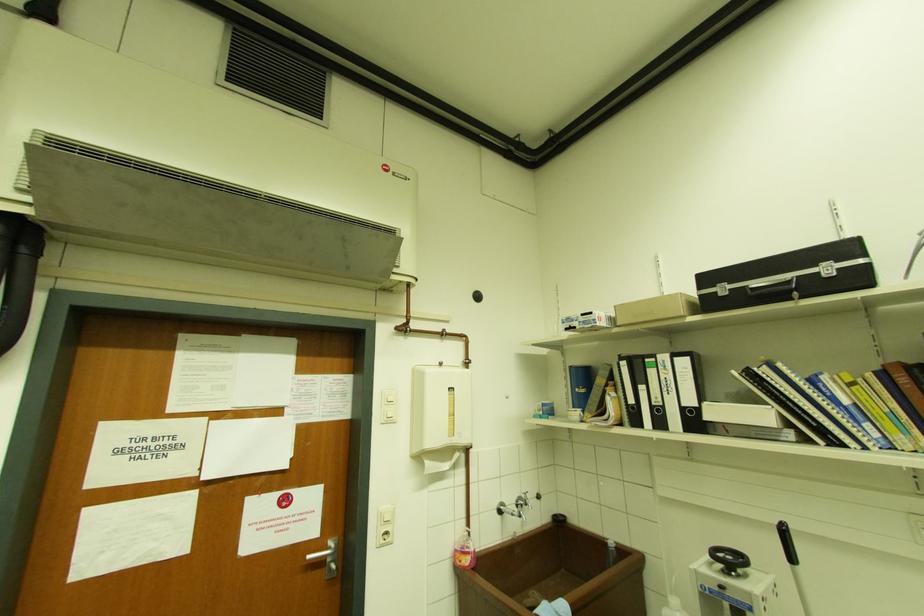
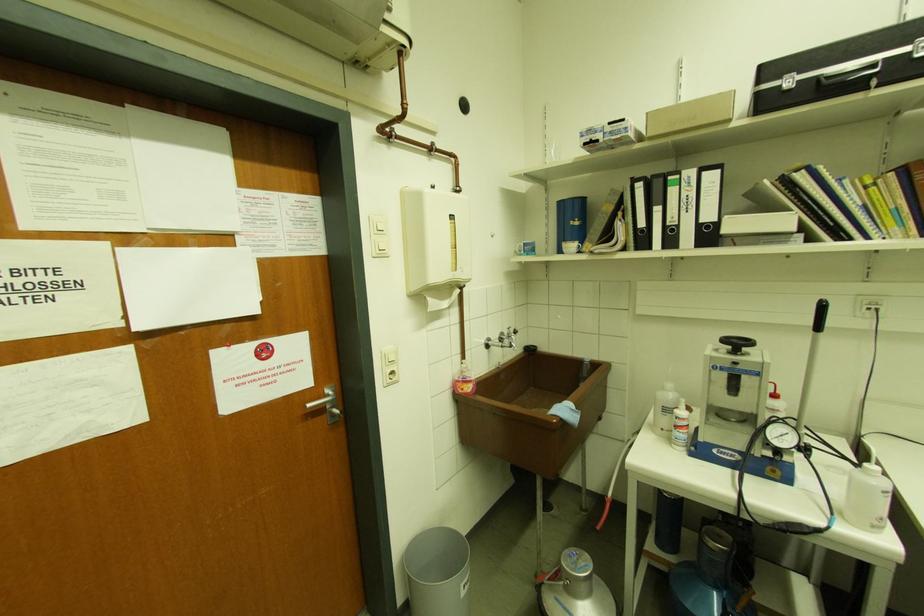
The first image is from the beginning of the video and the second image is from the end. How did the camera likely rotate when shooting the video?

The camera's rotation is toward right-down.